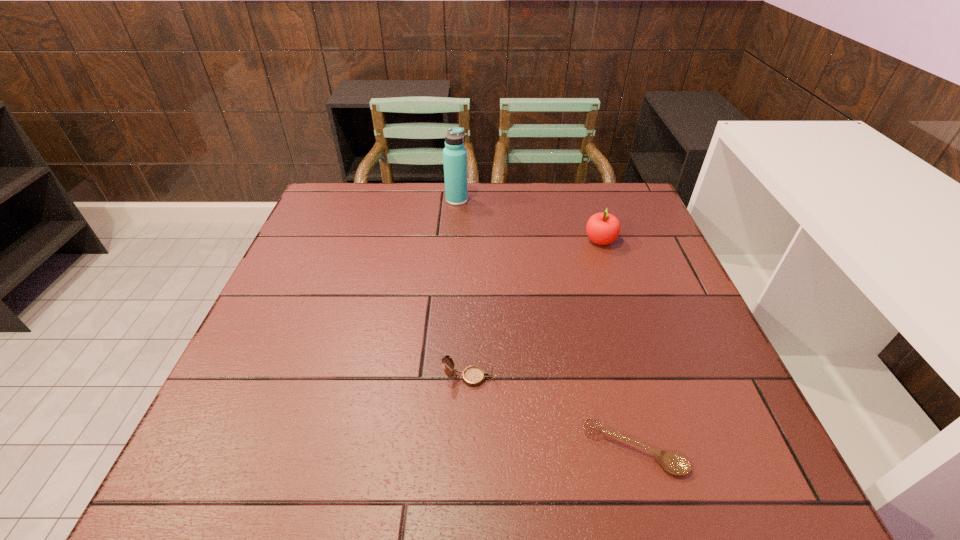
Identify the location of free space between the shortest object and the third nearest object. The width and height of the screenshot is (960, 540). pos(617,345).

This screenshot has width=960, height=540. I want to click on free spot between the second tallest object and the ladle, so click(x=617, y=345).

This screenshot has height=540, width=960. In order to click on object that is the second closest to the farthest object in this screenshot , I will do `click(473, 376)`.

Identify which object is the second closest to the tallest object. Please provide its 2D coordinates. Your answer should be formatted as a tuple, i.e. [(x, y)], where the tuple contains the x and y coordinates of a point satisfying the conditions above.

[(473, 376)]

Where is `vacant point that satisfies the following two spatial constraints: 1. on the face of the second nearest object; 2. on the back side of the ladle`? Image resolution: width=960 pixels, height=540 pixels. vacant point that satisfies the following two spatial constraints: 1. on the face of the second nearest object; 2. on the back side of the ladle is located at coordinates [468, 449].

Locate an element on the screen. blank space that satisfies the following two spatial constraints: 1. on the front side of the shortest object; 2. on the left side of the tallest object is located at coordinates (439, 449).

Find the location of `free point that satisfies the following two spatial constraints: 1. on the face of the compass; 2. on the back side of the ladle`. free point that satisfies the following two spatial constraints: 1. on the face of the compass; 2. on the back side of the ladle is located at coordinates [x=468, y=449].

Locate an element on the screen. Image resolution: width=960 pixels, height=540 pixels. vacant space that satisfies the following two spatial constraints: 1. on the face of the shortest object; 2. on the right side of the third farthest object is located at coordinates (468, 449).

Find the location of `free space that satisfies the following two spatial constraints: 1. on the back side of the ladle; 2. on the right side of the third shortest object`. free space that satisfies the following two spatial constraints: 1. on the back side of the ladle; 2. on the right side of the third shortest object is located at coordinates (577, 241).